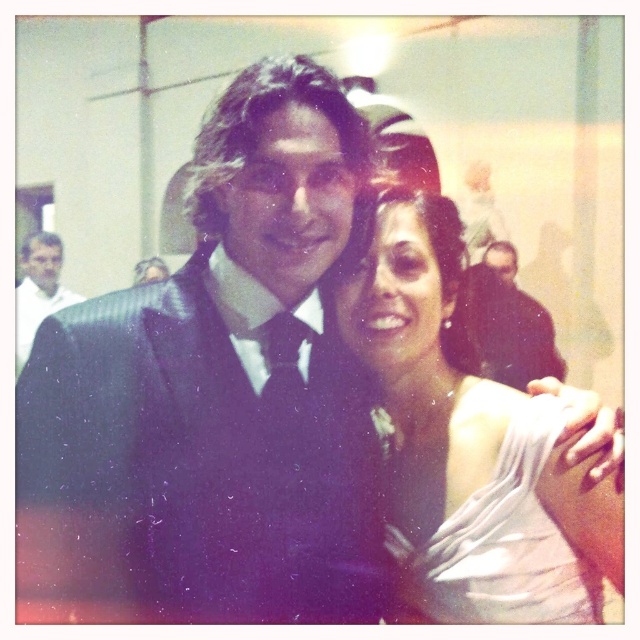
Can you confirm if satin white dress at center is smaller than silky white dress at center?

No.

Does point (564, 529) come in front of point (422, 584)?

Yes, point (564, 529) is closer to viewer.

Is point (532, 564) less distant than point (589, 582)?

Yes, it is.

Locate an element on the screen. This screenshot has width=640, height=640. satin white dress at center is located at coordinates (454, 429).

Does point (545, 538) come closer to viewer compared to point (44, 278)?

Yes, it is in front of point (44, 278).

Is point (403, 330) more distant than point (49, 264)?

That is False.

At what (x,y) coordinates should I click in order to perform the action: click on satin white dress at center. Please return your answer as a coordinate pair (x, y). The height and width of the screenshot is (640, 640). Looking at the image, I should click on (454, 429).

Is silky white dress at center thinner than shiny black suit at left?

Yes.

Who is higher up, silky white dress at center or shiny black suit at left?

Positioned higher is shiny black suit at left.

Who is more forward, (451, 451) or (42, 312)?

Point (451, 451)

Identify the location of silky white dress at center. The height and width of the screenshot is (640, 640). (499, 531).